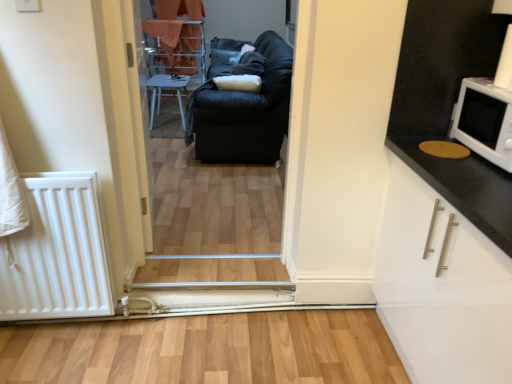
The width and height of the screenshot is (512, 384). In order to click on vacant space to the left of white glossy microwave at upper right in this screenshot , I will do `click(449, 163)`.